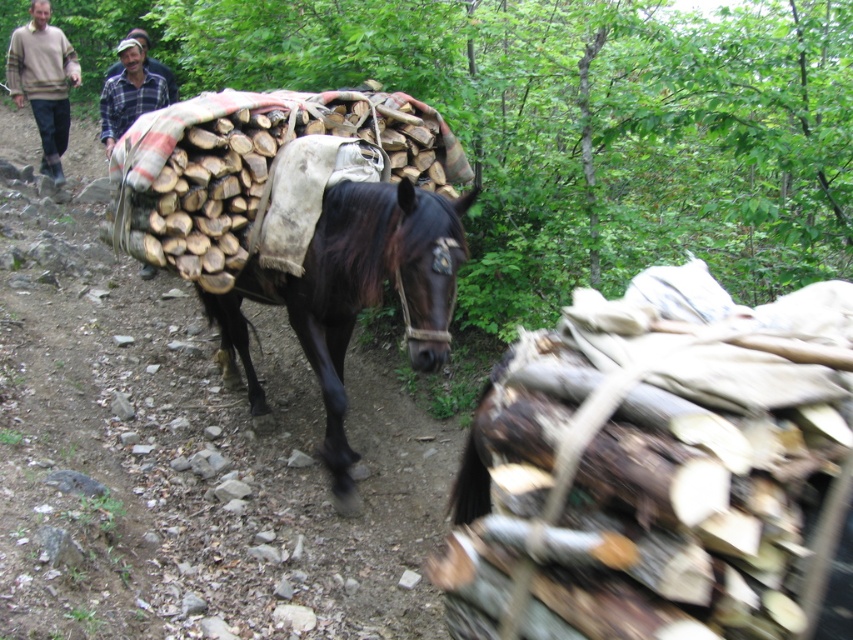
Question: Is wooden logs at center to the left of beige sweater at upper left from the viewer's perspective?

Choices:
 (A) no
 (B) yes

Answer: (A)

Question: Which object is positioned farthest from the wooden logs at center?

Choices:
 (A) beige sweater at upper left
 (B) shiny dark brown horse at center

Answer: (A)

Question: Is wooden logs at center bigger than beige sweater at upper left?

Choices:
 (A) yes
 (B) no

Answer: (B)

Question: Which object appears closest to the camera in this image?

Choices:
 (A) shiny dark brown horse at center
 (B) beige sweater at upper left
 (C) wooden logs at center

Answer: (A)

Question: Does wooden logs at center lie in front of shiny dark brown horse at center?

Choices:
 (A) yes
 (B) no

Answer: (B)

Question: Which object is positioned farthest from the beige sweater at upper left?

Choices:
 (A) shiny dark brown horse at center
 (B) wooden logs at center

Answer: (A)